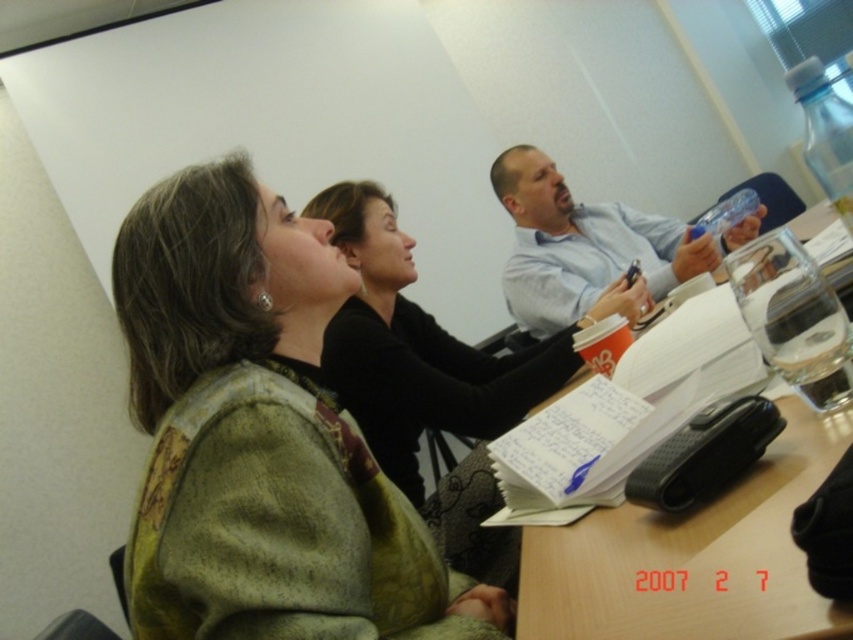
Question: Among these objects, which one is farthest from the camera?

Choices:
 (A) wooden table at center
 (B) blue shirt at upper center
 (C) green textured sweater at center

Answer: (B)

Question: Can you confirm if green textured sweater at center is positioned above blue shirt at upper center?

Choices:
 (A) no
 (B) yes

Answer: (A)

Question: Does green textured sweater at center have a smaller size compared to blue shirt at upper center?

Choices:
 (A) yes
 (B) no

Answer: (A)

Question: Which point is farther to the camera?

Choices:
 (A) (194, 592)
 (B) (686, 586)

Answer: (A)

Question: Is wooden table at center wider than blue shirt at upper center?

Choices:
 (A) yes
 (B) no

Answer: (B)

Question: Which point is closer to the camera?

Choices:
 (A) wooden table at center
 (B) green textured sweater at center

Answer: (A)